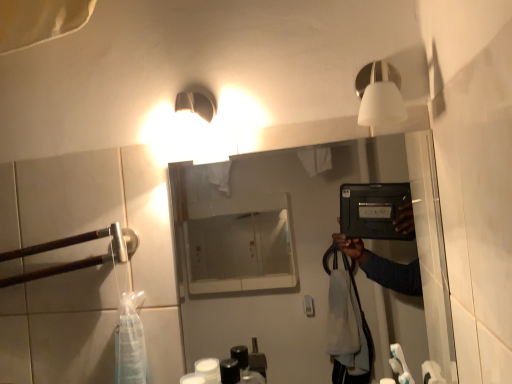
Question: Is brown wood at left wider than matte black tablet at center?

Choices:
 (A) no
 (B) yes

Answer: (B)

Question: Could you tell me if brown wood at left is facing matte black tablet at center?

Choices:
 (A) yes
 (B) no

Answer: (B)

Question: Could matte black tablet at center be considered to be inside brown wood at left?

Choices:
 (A) no
 (B) yes

Answer: (A)

Question: Is brown wood at left located outside matte black tablet at center?

Choices:
 (A) no
 (B) yes

Answer: (B)

Question: Does brown wood at left come behind matte black tablet at center?

Choices:
 (A) yes
 (B) no

Answer: (A)

Question: From the image's perspective, is brown wood at left on matte black tablet at center?

Choices:
 (A) yes
 (B) no

Answer: (B)

Question: From the image's perspective, does brown wood at left appear lower than white matte light fixture at upper right?

Choices:
 (A) yes
 (B) no

Answer: (A)

Question: Is brown wood at left looking in the opposite direction of white matte light fixture at upper right?

Choices:
 (A) yes
 (B) no

Answer: (B)

Question: Is brown wood at left outside of white matte light fixture at upper right?

Choices:
 (A) no
 (B) yes

Answer: (B)

Question: Considering the relative sizes of brown wood at left and white matte light fixture at upper right in the image provided, is brown wood at left bigger than white matte light fixture at upper right?

Choices:
 (A) no
 (B) yes

Answer: (B)

Question: Is the position of brown wood at left more distant than that of white matte light fixture at upper right?

Choices:
 (A) yes
 (B) no

Answer: (A)

Question: Considering the relative sizes of brown wood at left and white matte light fixture at upper right in the image provided, is brown wood at left wider than white matte light fixture at upper right?

Choices:
 (A) no
 (B) yes

Answer: (A)

Question: Can you confirm if matte black tablet at center is positioned to the right of white matte light fixture at upper right?

Choices:
 (A) no
 (B) yes

Answer: (A)